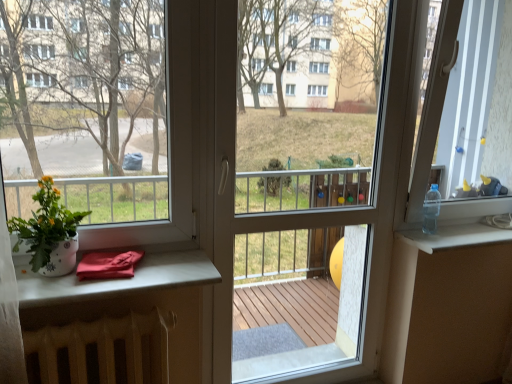
Question: Looking at the image, does transparent plastic bottle at upper right seem bigger or smaller compared to white glossy pot at left?

Choices:
 (A) big
 (B) small

Answer: (B)

Question: Relative to white glossy pot at left, is transparent plastic bottle at upper right in front or behind?

Choices:
 (A) front
 (B) behind

Answer: (B)

Question: Which of these objects is positioned farthest from the transparent plastic bottle at right?

Choices:
 (A) clear plastic bottle at upper right
 (B) transparent plastic screen door at center
 (C) white glossy pot at left
 (D) matte white table at lower left, placed as the 1th table when sorted from top to bottom
 (E) transparent plastic bottle at upper right

Answer: (C)

Question: Estimate the real-world distances between objects in this image. Which object is closer to the matte white table at lower left, placed as the 1th table when sorted from top to bottom?

Choices:
 (A) transparent plastic bottle at right
 (B) transparent plastic bottle at upper right
 (C) white glossy flower pot at left
 (D) white glossy pot at left
 (E) clear plastic bottle at upper right

Answer: (D)